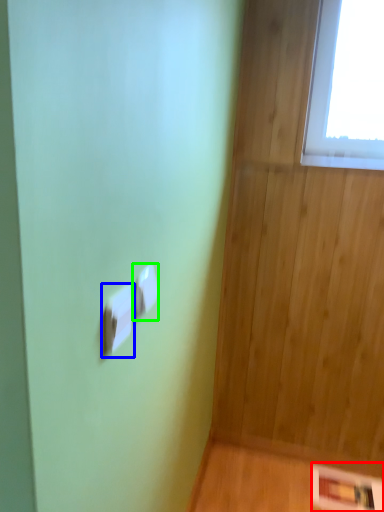
Question: Which is farther away from panel (highlighted by a red box)? light switch (highlighted by a blue box) or light switch (highlighted by a green box)?

Choices:
 (A) light switch
 (B) light switch

Answer: (A)